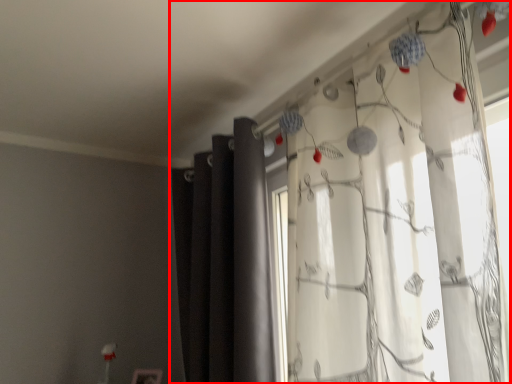
Question: In this image, where is curtain (annotated by the red box) located relative to curtain?

Choices:
 (A) right
 (B) left

Answer: (A)